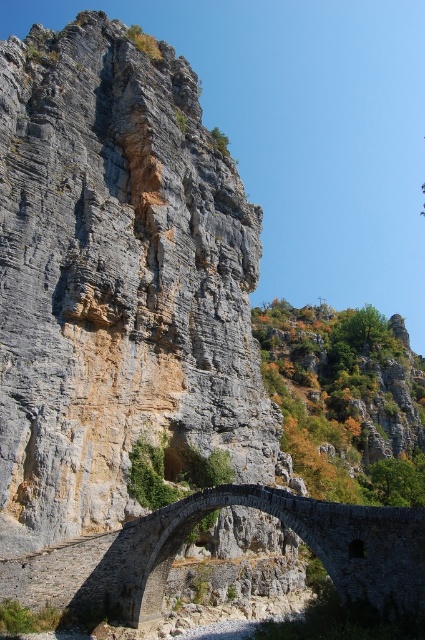
Consider the image. You are a hiker standing at the base of the cliff and want to cross to the other side. Which structure, the dark gray stone bridge at center or the green leafy hillside at center, is shorter and thus easier to climb over?

The dark gray stone bridge at center is shorter than the green leafy hillside at center, so it would be easier to climb over.

You are a hiker planning to cross the dark gray stone bridge at center. You want to know if you can see the green leafy hillside at center from the bridge. Can you see it from there?

Yes, the green leafy hillside at center is 62.10 meters away from the dark gray stone bridge at center, so you can see it from there.